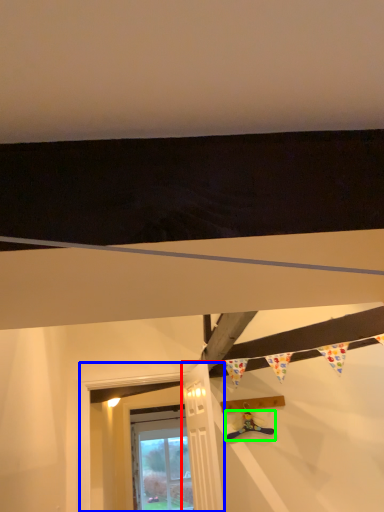
Question: Based on their relative distances, which object is farther from door (highlighted by a red box)? Choose from window frame (highlighted by a blue box) and toy (highlighted by a green box).

Choices:
 (A) window frame
 (B) toy

Answer: (A)